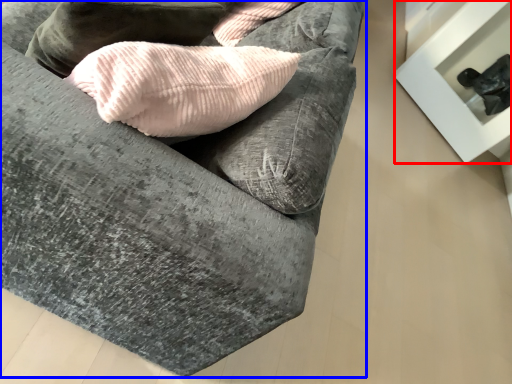
Question: Among these objects, which one is farthest to the camera, furniture (highlighted by a red box) or studio couch (highlighted by a blue box)?

Choices:
 (A) furniture
 (B) studio couch

Answer: (A)